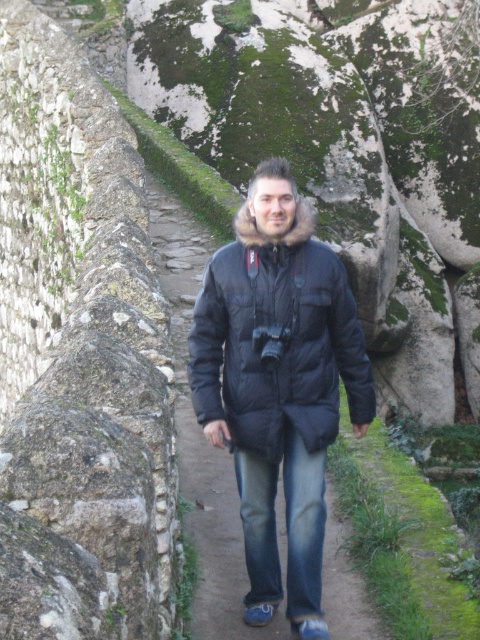
You are standing at the point closer to the camera in the image. Which point are you at, point [275,312] or point [291,454]?

You are at point [275,312] because it is further to the camera than point [291,454].